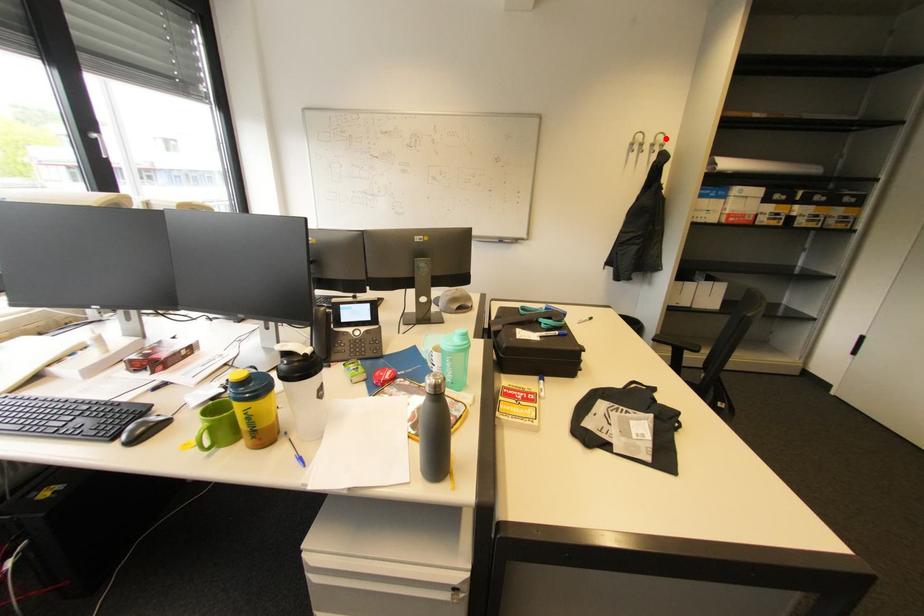
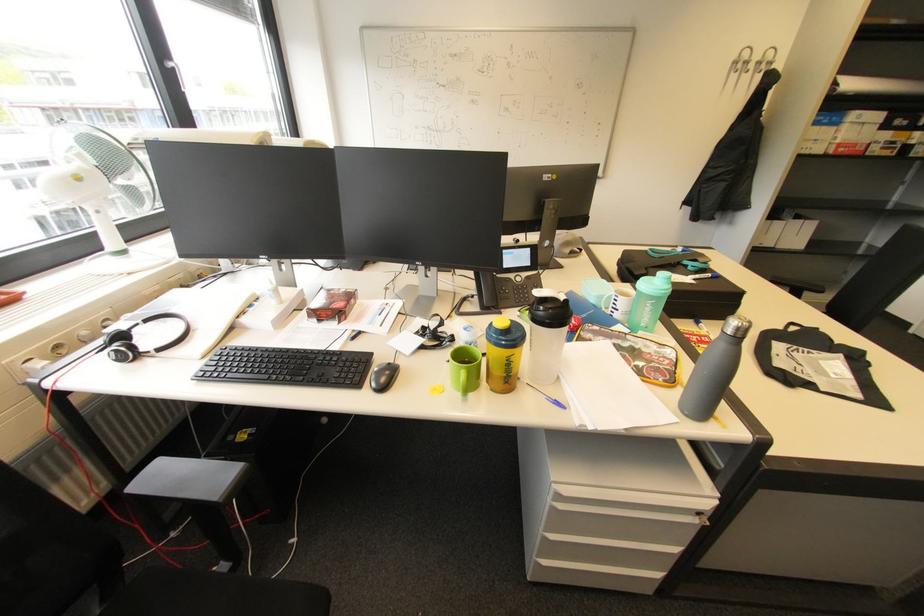
In the second image, find the point that corresponds to the highlighted location in the first image.

(775, 55)